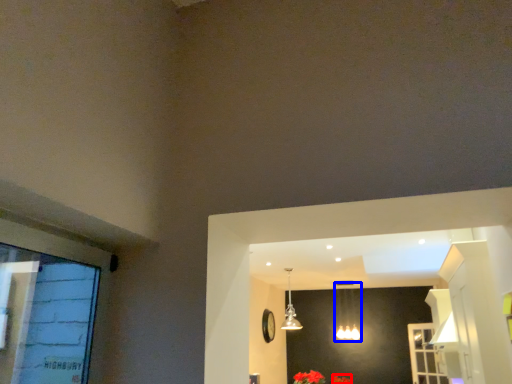
Question: Among these objects, which one is farthest to the camera, flower (highlighted by a red box) or lamp (highlighted by a blue box)?

Choices:
 (A) flower
 (B) lamp

Answer: (B)